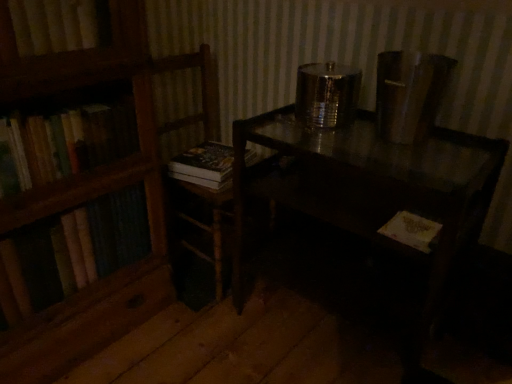
Question: In the image, is shiny dark wood table at center on the left side or the right side of wooden chair at left?

Choices:
 (A) right
 (B) left

Answer: (A)

Question: From a real-world perspective, is shiny dark wood table at center physically located above or below wooden chair at left?

Choices:
 (A) above
 (B) below

Answer: (B)

Question: Estimate the real-world distances between objects in this image. Which object is farther from the hardcover book at center, the second book viewed from the right?

Choices:
 (A) wooden chair at left
 (B) yellow paper book at lower right, acting as the 2th book starting from the back
 (C) shiny dark wood table at center

Answer: (B)

Question: Which object is the closest to the shiny dark wood table at center?

Choices:
 (A) wooden chair at left
 (B) hardcover book at center, which is the 2th book in front-to-back order
 (C) yellow paper book at lower right, the 1th book positioned from the bottom

Answer: (C)